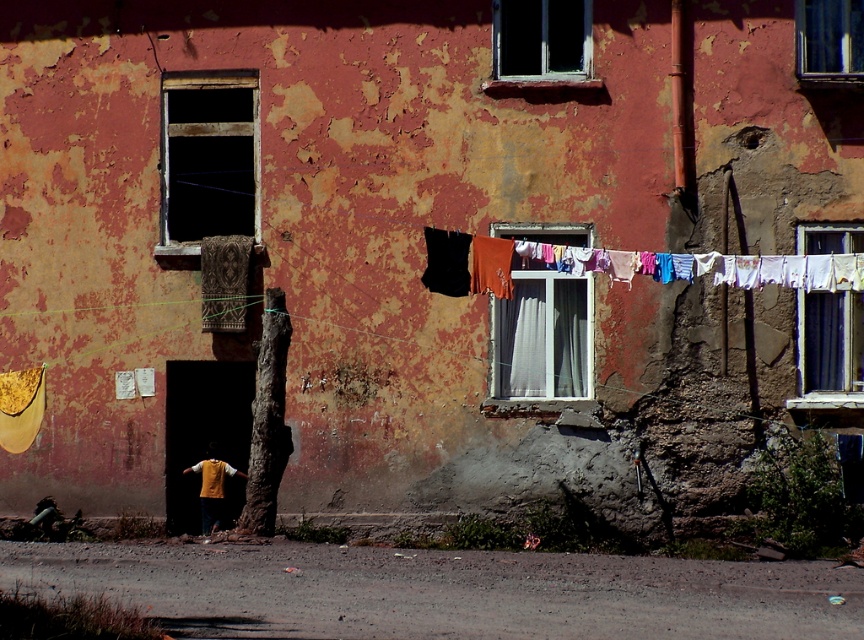
You are standing in front of the weathered red building and notice the multicolored fabric clothesline at center and the white plastic window at center. Which object is positioned to the right of the other?

The multicolored fabric clothesline at center is to the right of the white plastic window at center according to the description.

You are an architect inspecting the building. You notice the dark glass window at upper left and the white sheer curtain at upper right. Which object has a greater width?

The dark glass window at upper left has a greater width than the white sheer curtain at upper right according to the description.

You are standing in front of the weathered red building. You notice the dark glass window at upper left and the white sheer curtain at upper right. Which object is located to the left of the other?

The dark glass window at upper left is positioned on the left side of white sheer curtain at upper right.